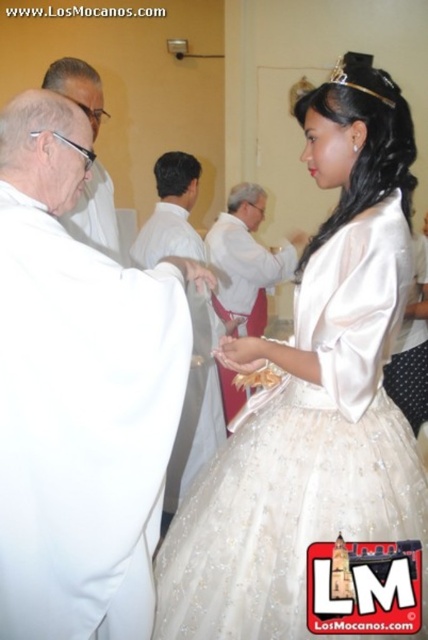
Describe the element at coordinates (305, 456) in the screenshot. I see `ivory satin dress at center` at that location.

Between ivory satin dress at center and matte white robe at left, which one has less height?

matte white robe at left

Does point (296, 508) lie in front of point (101, 211)?

Yes.

What are the coordinates of `ivory satin dress at center` in the screenshot? It's located at (305, 456).

Who is more forward, (160,616) or (196,356)?

Positioned in front is point (160,616).

Is ivory satin dress at center taller than white satin shirt at center?

Answer: In fact, ivory satin dress at center may be shorter than white satin shirt at center.

Does point (321, 408) come in front of point (171, 497)?

Yes, it is.

The height and width of the screenshot is (640, 428). I want to click on ivory satin dress at center, so click(x=305, y=456).

Consider the image. Between white satin robe at center and matte white robe at left, which one is positioned higher?

matte white robe at left

Find the location of `white satin robe at center`. white satin robe at center is located at coordinates (246, 260).

Locate an element on the screen. This screenshot has width=428, height=640. white satin robe at center is located at coordinates (246, 260).

You are a GUI agent. You are given a task and a screenshot of the screen. Output one action in this format:
    pyautogui.click(x=<x>, y=<y>)
    Task: Click on the white satin robe at center
    Image resolution: width=428 pixels, height=640 pixels.
    Given the screenshot: What is the action you would take?
    pyautogui.click(x=246, y=260)